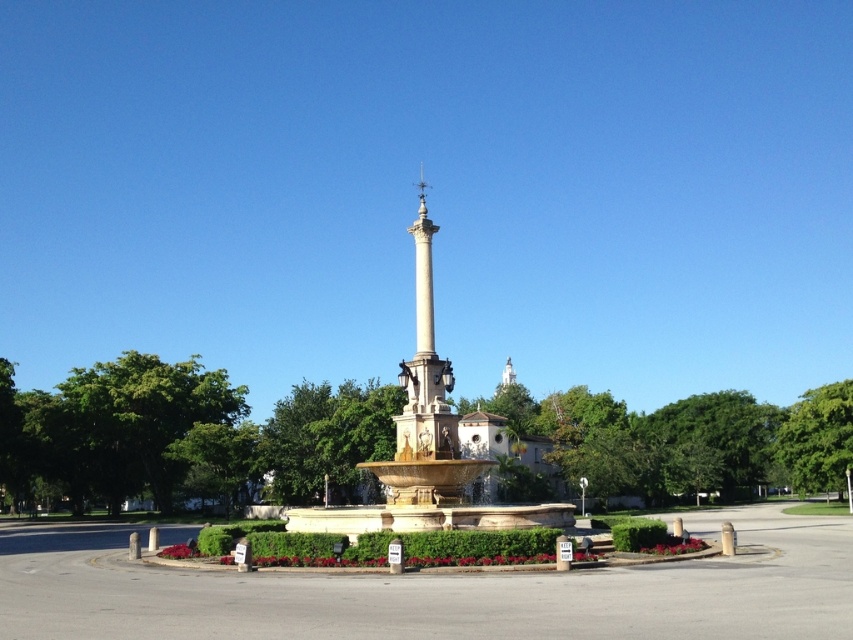
You are a landscape architect designing a pathway around the golden stone fountain at center and the beige stone column at center. Which object requires a wider path around it based on their sizes?

The golden stone fountain at center might be wider than the beige stone column at center, so the pathway around the golden stone fountain at center should be wider to accommodate its size.

You are standing in the public square and want to take a photo of the golden stone fountain at center and the beige stone column at center. Which one appears lower in the photo?

The golden stone fountain at center is located below the beige stone column at center, so it will appear lower in the photo.

You are a visitor standing in front of the grand fountain in the public square. You notice the golden stone fountain at center and the beige stone column at center. Which object is taller?

The golden stone fountain at center is taller than the beige stone column at center.